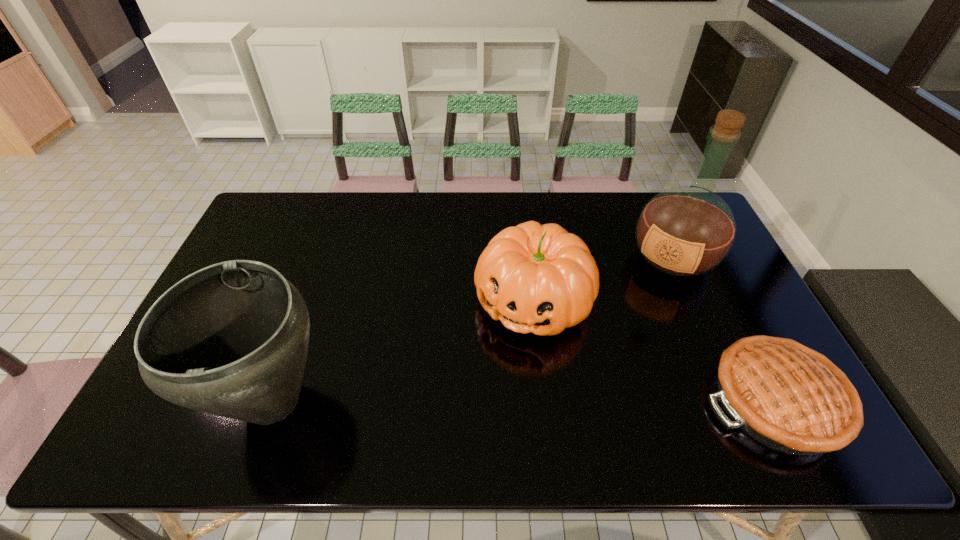
Find the location of a particular element. free space on the desktop that is between the third shortest object and the shortest object and is positioned on the front label of the liquor is located at coordinates [583, 401].

Where is `vacant space on the desktop that is between the third shortest object and the pie and is positioned on the carved face of the pumpkin`? This screenshot has width=960, height=540. vacant space on the desktop that is between the third shortest object and the pie and is positioned on the carved face of the pumpkin is located at coordinates (477, 401).